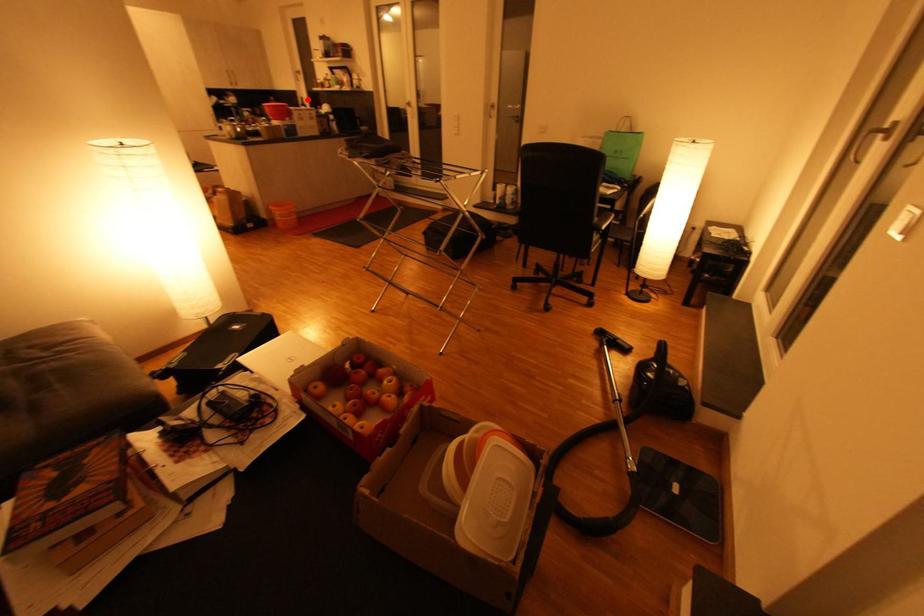
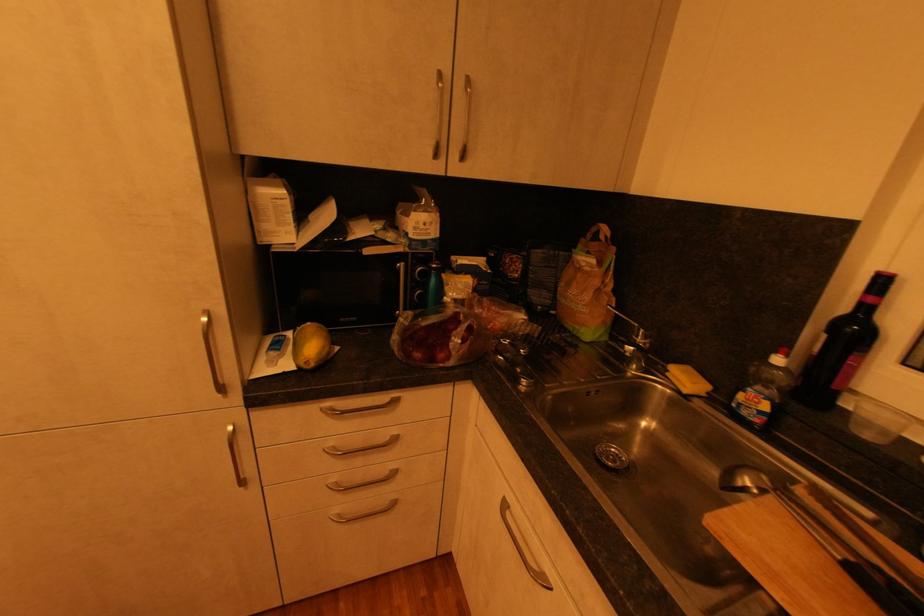
Question: A red point is marked in image1. In image2, is the corresponding 3D point closer to the camera or farther? Reply with the corresponding letter.

Choices:
 (A) The corresponding 3D point is closer.
 (B) The corresponding 3D point is farther.

Answer: (B)